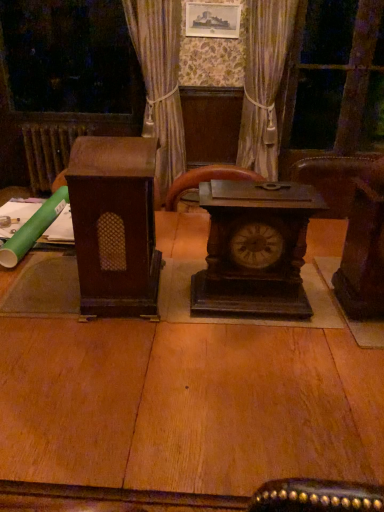
Question: Considering the relative sizes of brown wooden radiator at left and dark wood chair at right, which is counted as the second furniture, starting from the left, in the image provided, is brown wooden radiator at left smaller than dark wood chair at right, which is counted as the second furniture, starting from the left,?

Choices:
 (A) no
 (B) yes

Answer: (A)

Question: Does brown wooden radiator at left appear on the right side of dark wood chair at right, the 1th furniture when ordered from right to left?

Choices:
 (A) no
 (B) yes

Answer: (A)

Question: Is brown wooden radiator at left shorter than dark wood chair at right, the 1th furniture when ordered from right to left?

Choices:
 (A) yes
 (B) no

Answer: (B)

Question: Is brown wooden radiator at left taller than dark wood chair at right, the 1th furniture when ordered from right to left?

Choices:
 (A) no
 (B) yes

Answer: (B)

Question: Could dark wood chair at right, the 1th furniture when ordered from right to left, be considered to be inside brown wooden radiator at left?

Choices:
 (A) no
 (B) yes

Answer: (A)

Question: From a real-world perspective, is transparent glass door at upper right physically located above or below dark brown wood clock at center?

Choices:
 (A) below
 (B) above

Answer: (B)

Question: Is transparent glass door at upper right bigger or smaller than dark brown wood clock at center?

Choices:
 (A) big
 (B) small

Answer: (A)

Question: Is point (354, 83) closer or farther from the camera than point (269, 241)?

Choices:
 (A) farther
 (B) closer

Answer: (A)

Question: Considering the positions of transparent glass door at upper right and dark brown wood clock at center in the image, is transparent glass door at upper right taller or shorter than dark brown wood clock at center?

Choices:
 (A) tall
 (B) short

Answer: (A)

Question: Is transparent glass door at upper right taller or shorter than dark wood chair at right, which is counted as the second furniture, starting from the left?

Choices:
 (A) tall
 (B) short

Answer: (A)

Question: Considering the positions of point (296, 50) and point (347, 268), is point (296, 50) closer or farther from the camera than point (347, 268)?

Choices:
 (A) farther
 (B) closer

Answer: (A)

Question: In terms of width, does transparent glass door at upper right look wider or thinner when compared to dark wood chair at right, which is counted as the second furniture, starting from the left?

Choices:
 (A) wide
 (B) thin

Answer: (B)

Question: From a real-world perspective, relative to dark wood chair at right, the 1th furniture when ordered from right to left, is transparent glass door at upper right vertically above or below?

Choices:
 (A) above
 (B) below

Answer: (B)

Question: In the image, is brown wood speaker at left, which appears as the second furniture when viewed from the right, positioned in front of or behind dark brown wood clock at center?

Choices:
 (A) behind
 (B) front

Answer: (B)

Question: Based on their sizes in the image, would you say brown wood speaker at left, the 1th furniture viewed from the left, is bigger or smaller than dark brown wood clock at center?

Choices:
 (A) big
 (B) small

Answer: (A)